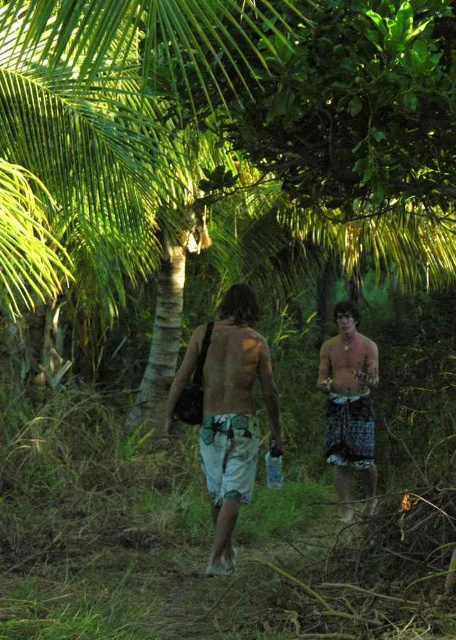
You are a photographer trying to capture a photo of both individuals in the scene. You notice two points of interest marked as point 1 at coordinates (222, 387) and point 2 at coordinates (346, 515). Which point is closer to the camera so that you can focus on it first?

Point 1 at coordinates (222, 387) is closer to the camera than point 2 at coordinates (346, 515), so you should focus on point 1 first.

You are a photographer trying to capture both the green patterned shorts at center and the patterned shorts at right in a single frame. Based on their sizes in the image, which one might you need to zoom in or out to focus on while still keeping both in the shot?

The green patterned shorts at center occupies less space than patterned shorts at right, so you might need to zoom out to ensure both are in the frame while focusing on the larger patterned shorts at right.

You are a hiker in a tropical jungle. You see a point marked at coordinates (233,412). According to the image, what is located at that point?

The point at coordinates (233,412) marks green patterned shorts at center.